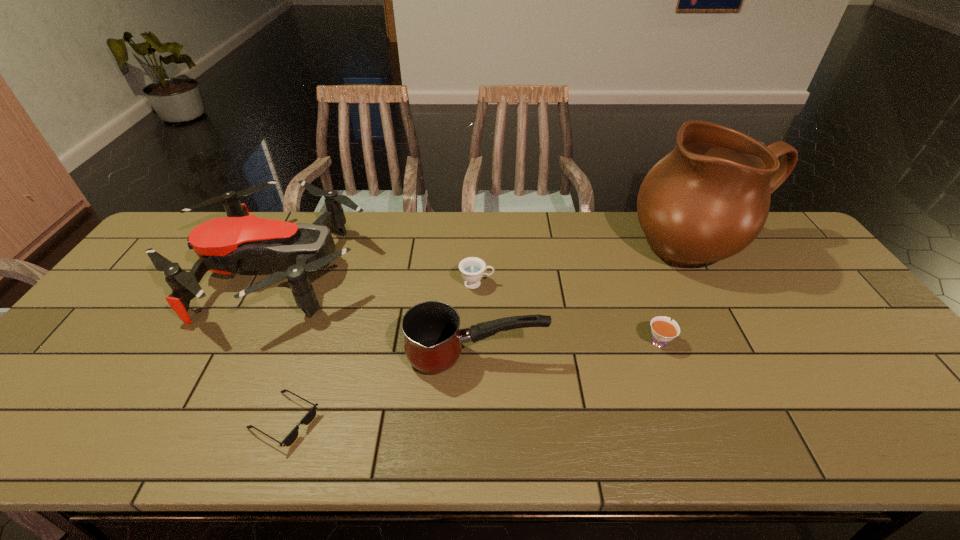
Locate an element on the screen. This screenshot has width=960, height=540. free space between the saucepan and the tallest object is located at coordinates (588, 303).

You are a GUI agent. You are given a task and a screenshot of the screen. Output one action in this format:
    pyautogui.click(x=<x>, y=<y>)
    Task: Click on the unoccupied area between the saucepan and the drone
    
    Given the screenshot: What is the action you would take?
    pyautogui.click(x=376, y=314)

The image size is (960, 540). Find the location of `empty location between the nearest object and the saucepan`. empty location between the nearest object and the saucepan is located at coordinates click(380, 389).

Find the location of a particular element. This screenshot has width=960, height=540. free space between the saucepan and the left teacup is located at coordinates pos(476,320).

Find the location of a particular element. free space between the drone and the sunglasses is located at coordinates (280, 346).

Locate an element on the screen. Image resolution: width=960 pixels, height=540 pixels. unoccupied position between the left teacup and the drone is located at coordinates (377, 277).

I want to click on free space between the drone and the nearest object, so click(280, 346).

You are a GUI agent. You are given a task and a screenshot of the screen. Output one action in this format:
    pyautogui.click(x=<x>, y=<y>)
    Task: Click on the object that stands as the fourth closest to the nearest object
    
    Given the screenshot: What is the action you would take?
    pyautogui.click(x=663, y=330)

You are a GUI agent. You are given a task and a screenshot of the screen. Output one action in this format:
    pyautogui.click(x=<x>, y=<y>)
    Task: Click on the object that stands as the closest to the farther teacup
    
    Given the screenshot: What is the action you would take?
    pyautogui.click(x=433, y=341)

The width and height of the screenshot is (960, 540). I want to click on vacant position in the image that satisfies the following two spatial constraints: 1. on the camera side of the drone; 2. on the side of the shorter teacup with the handle, so click(242, 341).